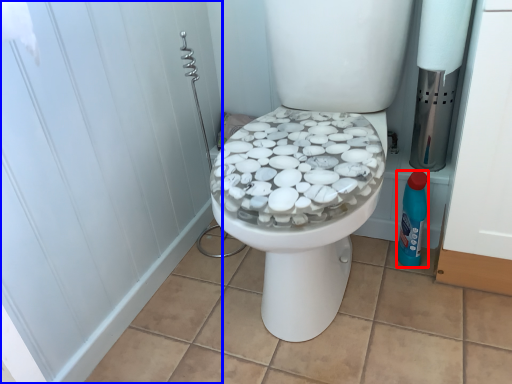
Question: Which point is closer to the camera, cleaning product (highlighted by a red box) or screen door (highlighted by a blue box)?

Choices:
 (A) cleaning product
 (B) screen door

Answer: (B)